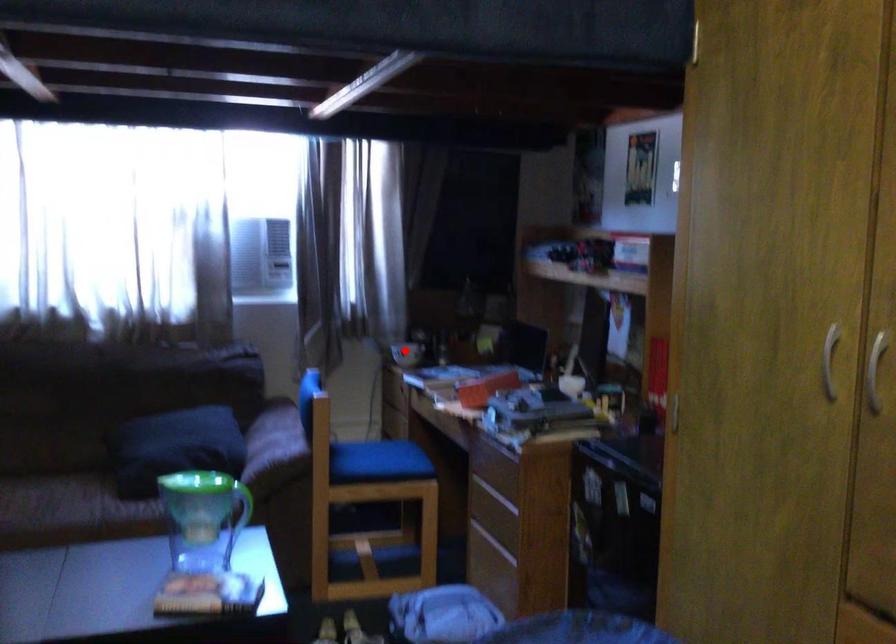
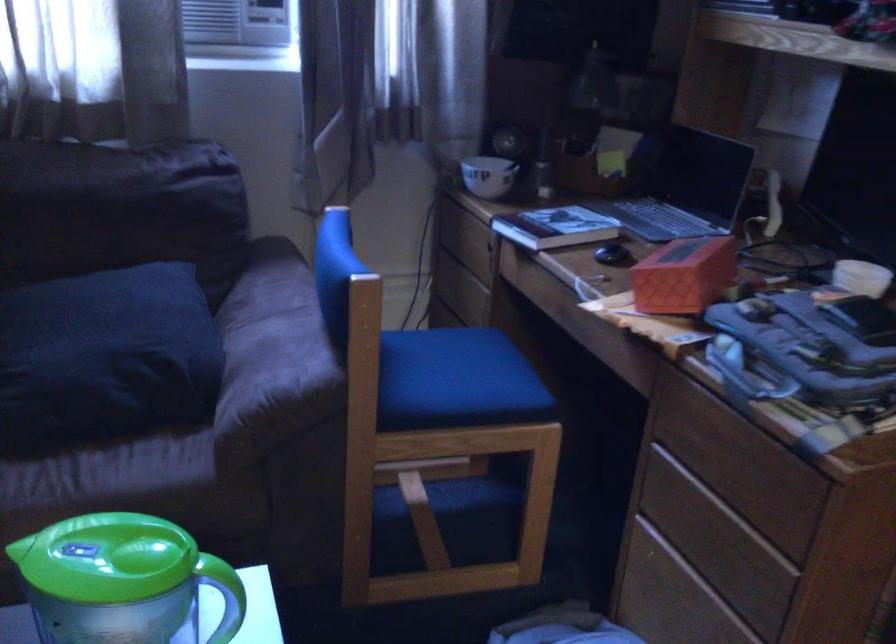
Question: I am providing you with two images of the same scene from different viewpoints. Image1 has a red point marked. In image2, the corresponding 3D location appears at what relative position? Reply with the corresponding letter.

Choices:
 (A) Closer
 (B) Farther

Answer: (A)